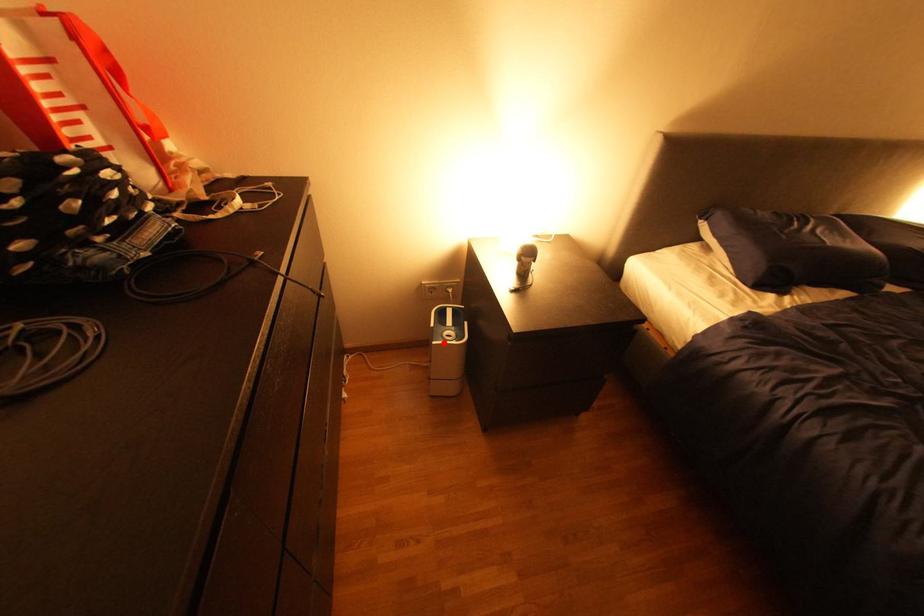
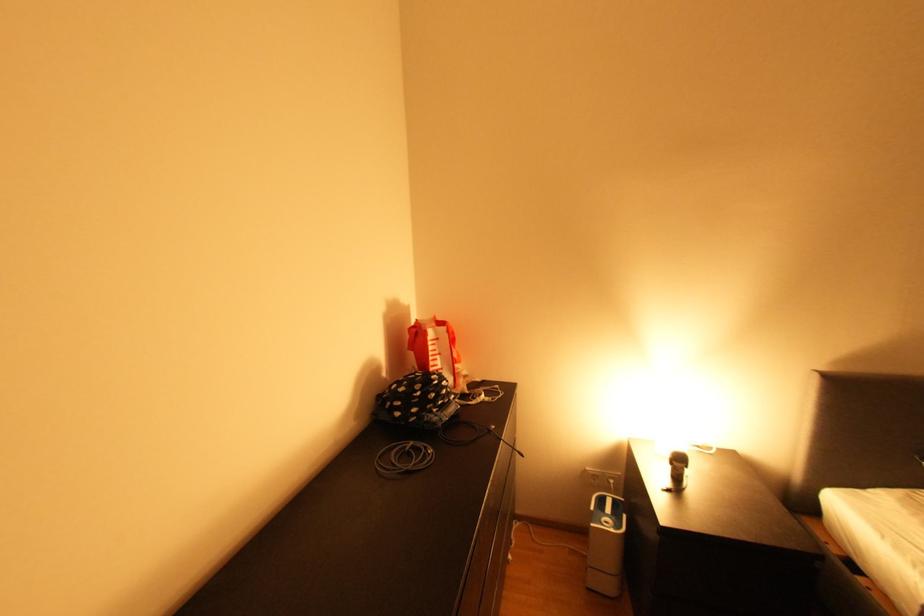
In the second image, find the point that corresponds to the highlighted location in the first image.

(602, 525)